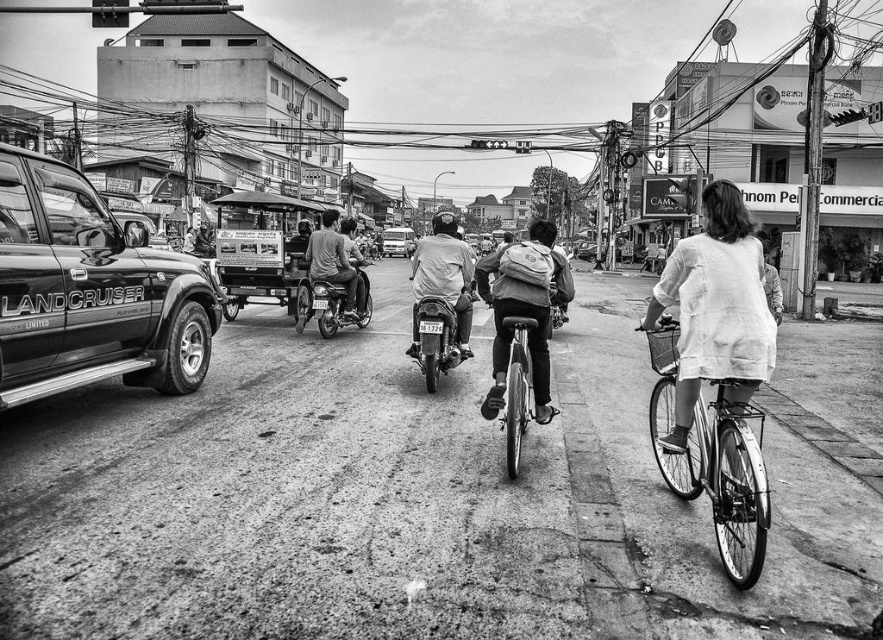
Question: Observing the image, what is the correct spatial positioning of white cotton shirt at right in reference to metallic silver bicycle at center?

Choices:
 (A) left
 (B) right

Answer: (B)

Question: Among these points, which one is nearest to the camera?

Choices:
 (A) (361, 298)
 (B) (519, 436)
 (C) (474, 278)
 (D) (425, 248)

Answer: (B)

Question: Is metallic wires at upper center positioned before metallic silver motorbike at center?

Choices:
 (A) no
 (B) yes

Answer: (A)

Question: Which object is positioned closest to the light gray fabric shirt at center?

Choices:
 (A) metallic silver motorbike at center
 (B) metallic silver bicycle at right

Answer: (A)

Question: Which of the following is the farthest from the observer?

Choices:
 (A) metallic silver bicycle at center
 (B) metallic silver motorcycle at center

Answer: (B)

Question: Can you confirm if matte black backpack at center is bigger than metallic silver motorcycle at center?

Choices:
 (A) yes
 (B) no

Answer: (A)